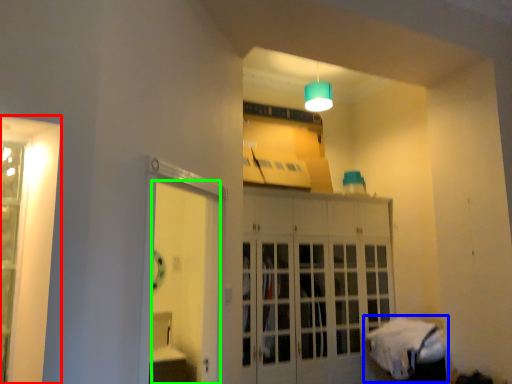
Question: Considering the real-world distances, which object is farthest from window (highlighted by a red box)? bed (highlighted by a blue box) or door (highlighted by a green box)?

Choices:
 (A) bed
 (B) door

Answer: (A)